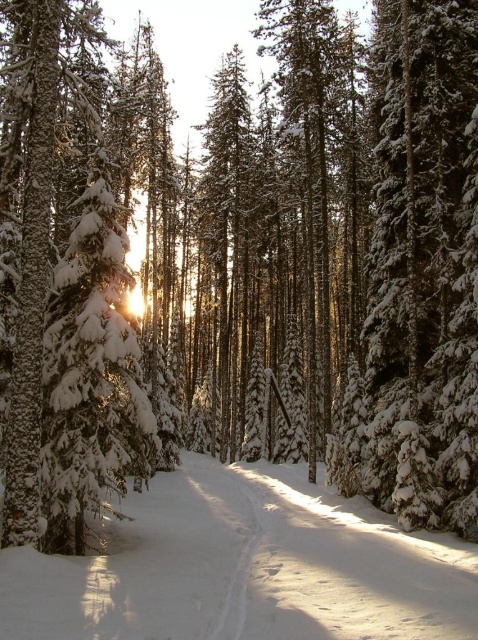
Question: Does white snow path at center lie behind snow-covered evergreen tree at right?

Choices:
 (A) yes
 (B) no

Answer: (B)

Question: Which of these objects is positioned farthest from the white snow-covered tree at left?

Choices:
 (A) white snow path at center
 (B) snow-covered evergreen tree at right

Answer: (B)

Question: Is snow-covered evergreen tree at right below white snow-covered tree at left?

Choices:
 (A) no
 (B) yes

Answer: (B)

Question: Can you confirm if snow-covered evergreen tree at right is smaller than white snow-covered tree at left?

Choices:
 (A) yes
 (B) no

Answer: (B)

Question: Among these objects, which one is farthest from the camera?

Choices:
 (A) white snow path at center
 (B) snow-covered evergreen tree at right
 (C) white snow-covered tree at left

Answer: (B)

Question: Which of the following is the closest to the observer?

Choices:
 (A) click(96, 570)
 (B) click(129, 275)

Answer: (A)